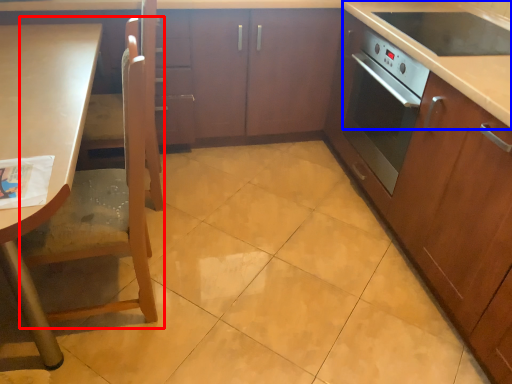
Question: Which of the following is the closest to the observer, chair (highlighted by a red box) or counter top (highlighted by a blue box)?

Choices:
 (A) chair
 (B) counter top

Answer: (A)